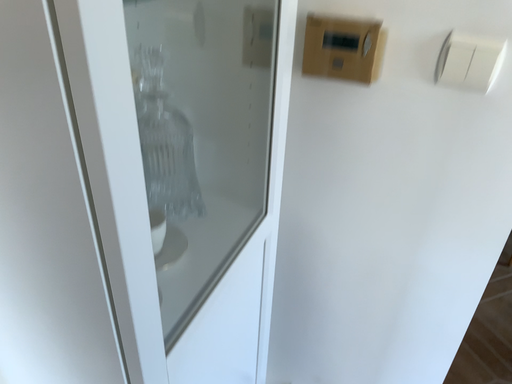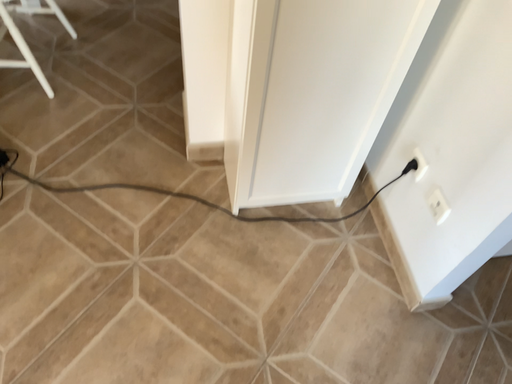
Question: Which way did the camera rotate in the video?

Choices:
 (A) rotated right
 (B) rotated left

Answer: (B)